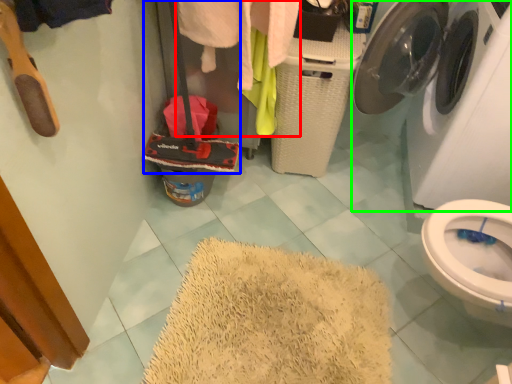
Question: Considering the real-world distances, which object is farthest from clothing (highlighted by a red box)? luggage (highlighted by a blue box) or washing machine (highlighted by a green box)?

Choices:
 (A) luggage
 (B) washing machine

Answer: (B)